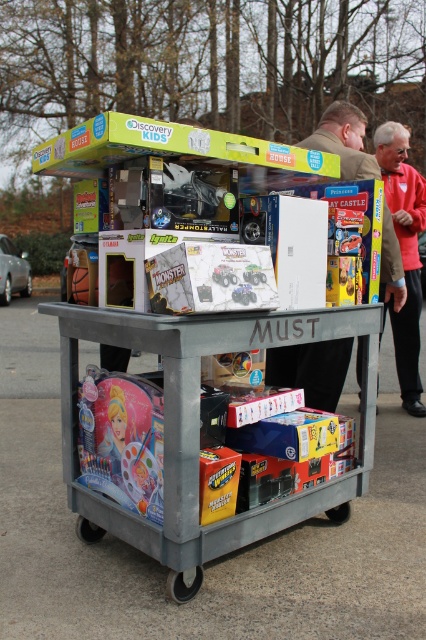
Question: Which point is farther to the camera?

Choices:
 (A) (402, 298)
 (B) (282, 310)
 (C) (414, 172)

Answer: (C)

Question: Which object is the closest to the matte pink princess doll at lower left?

Choices:
 (A) matte black monster truck at center
 (B) brown leather jacket at upper right
 (C) metallic gray cart at center

Answer: (C)

Question: Is metallic gray cart at center to the left of matte pink princess doll at lower left from the viewer's perspective?

Choices:
 (A) no
 (B) yes

Answer: (A)

Question: Based on their relative distances, which object is farther from the matte white plastic toy car at center?

Choices:
 (A) matte black monster truck at center
 (B) matte pink princess doll at lower left
 (C) metallic gray cart at center

Answer: (B)

Question: Does metallic gray cart at center come behind matte white plastic toy car at center?

Choices:
 (A) no
 (B) yes

Answer: (A)

Question: Does metallic gray cart at center have a smaller size compared to red jacket at upper right?

Choices:
 (A) no
 (B) yes

Answer: (A)